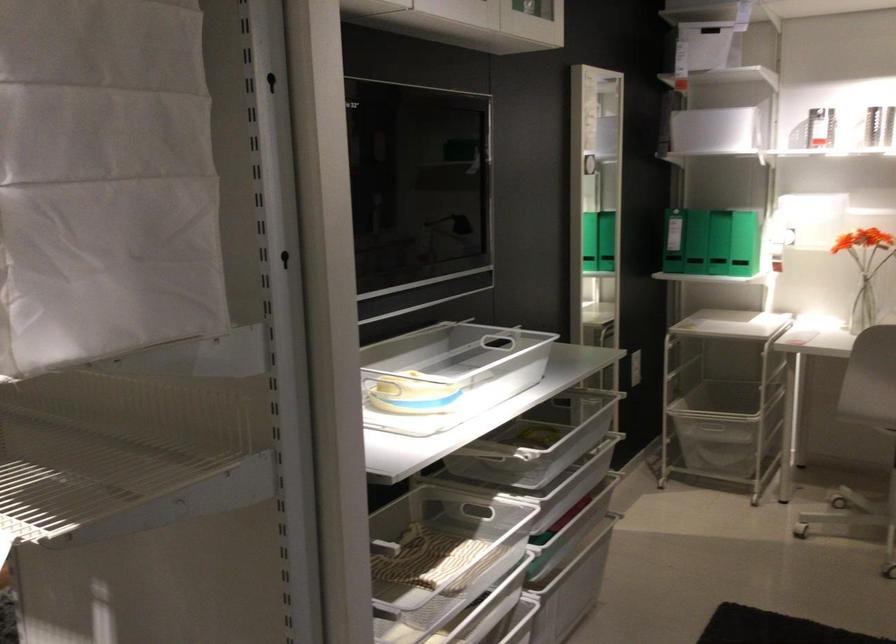
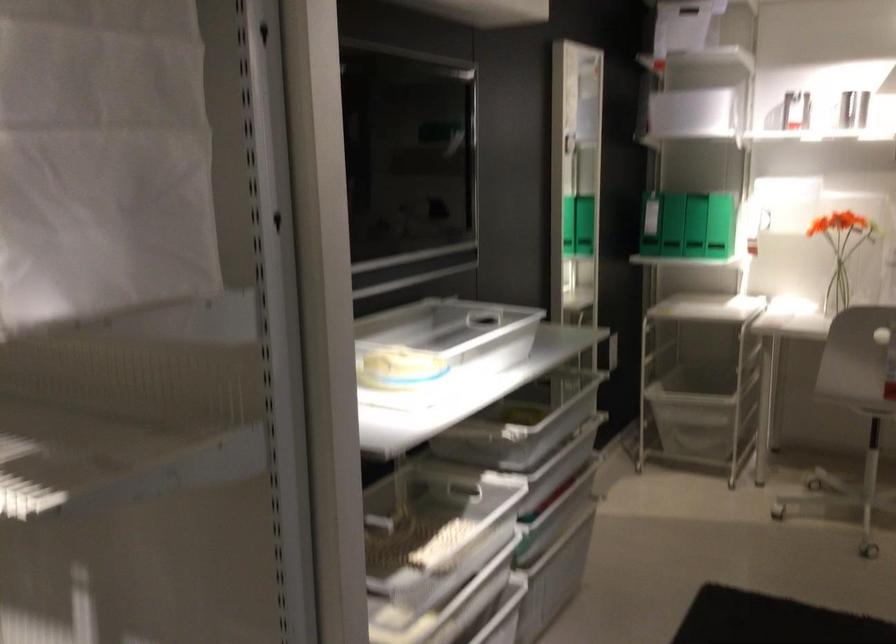
In a continuous first-person perspective shot, in which direction is the camera moving?

The cameraman moved toward left, forward.